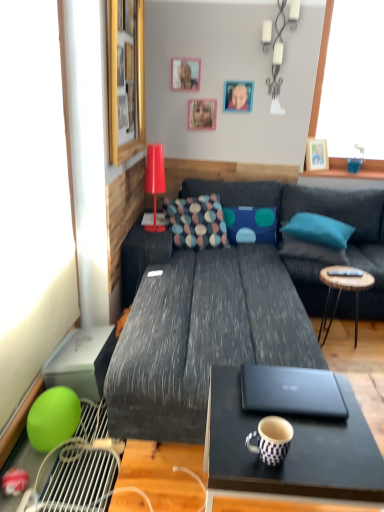
Question: Is point [x=238, y=210] closer or farther from the camera than point [x=355, y=297]?

Choices:
 (A) closer
 (B) farther

Answer: (B)

Question: Looking at the image, does blue fabric pillow at center, acting as the 3th pillow starting from the right, seem bigger or smaller compared to wooden round table at right?

Choices:
 (A) small
 (B) big

Answer: (A)

Question: Estimate the real-world distances between objects in this image. Which object is farther from the multicolored fabric pillow at center, which appears as the 1th pillow when viewed from the left?

Choices:
 (A) wooden picture frame at upper right, which ranks as the 1th picture frame in right-to-left order
 (B) blue and white checkered coffee cup at lower center
 (C) wooden picture frame at upper center, which is counted as the 2th picture frame, starting from the left
 (D) matte red table lamp at upper center
 (E) wooden round table at right

Answer: (B)

Question: Estimate the real-world distances between objects in this image. Which object is farther from the dark gray fabric couch at center?

Choices:
 (A) wooden picture frame at upper center, positioned as the 3th picture frame in right-to-left order
 (B) silver metallic candle holder at upper center
 (C) matte black coffee table at lower right
 (D) blue fabric pillow at center, arranged as the 2th pillow when viewed from the left
 (E) blue and white checkered coffee cup at lower center

Answer: (A)